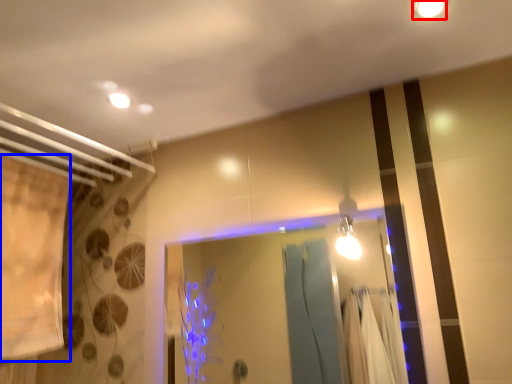
Question: Which of the following is the closest to the observer, light fixture (highlighted by a red box) or shower curtain (highlighted by a blue box)?

Choices:
 (A) light fixture
 (B) shower curtain

Answer: (A)